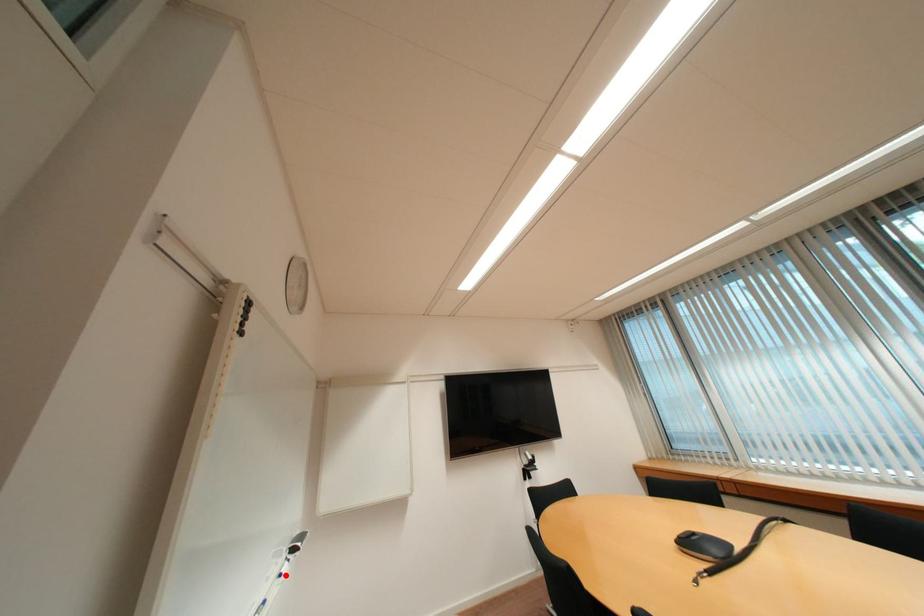
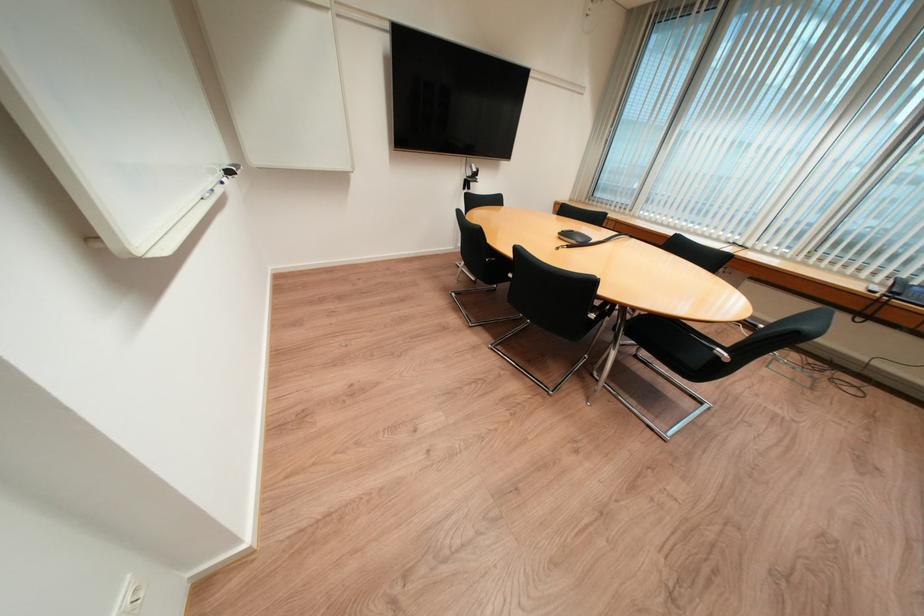
Question: I am providing you with two images of the same scene from different viewpoints. A red point is marked on the first image. Can you still see the location of the red point in image 2?

Choices:
 (A) Yes
 (B) No

Answer: (A)